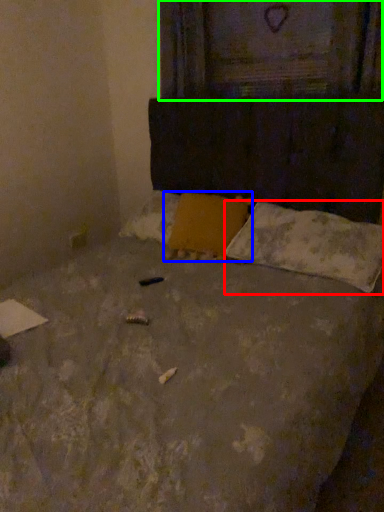
Question: Which object is positioned closest to pillow (highlighted by a red box)? Select from pillow (highlighted by a blue box) and window frame (highlighted by a green box).

Choices:
 (A) pillow
 (B) window frame

Answer: (A)